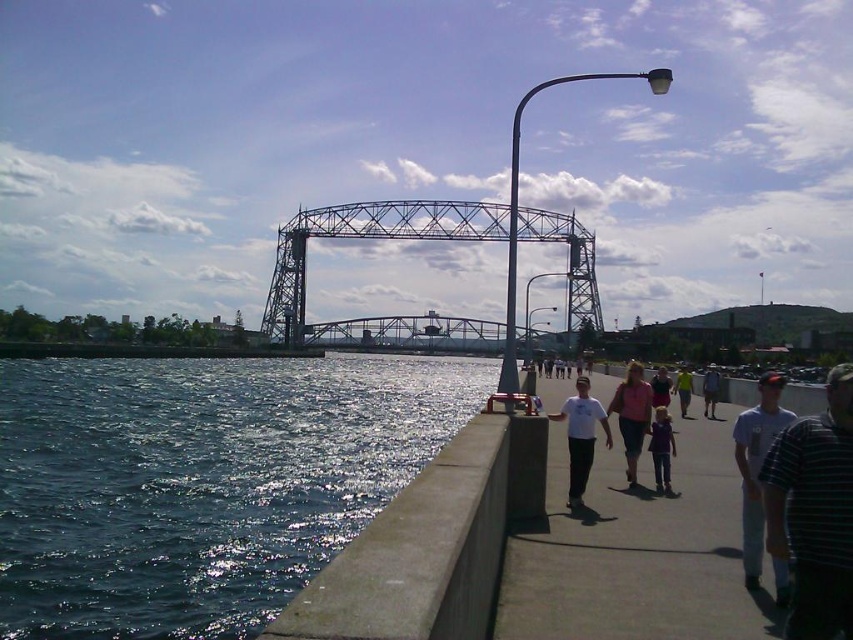
Does concrete sidewalk at center have a lesser height compared to pink fabric shirt at center?

Incorrect, concrete sidewalk at center's height does not fall short of pink fabric shirt at center's.

Who is lower down, concrete sidewalk at center or pink fabric shirt at center?

Positioned lower is concrete sidewalk at center.

You are a GUI agent. You are given a task and a screenshot of the screen. Output one action in this format:
    pyautogui.click(x=<x>, y=<y>)
    Task: Click on the concrete sidewalk at center
    This screenshot has width=853, height=640.
    Given the screenshot: What is the action you would take?
    pyautogui.click(x=637, y=550)

Who is more forward, (563,538) or (752,454)?

Point (563,538)

Does concrete sidewalk at center have a greater width compared to white cotton shirt at right?

Indeed, concrete sidewalk at center has a greater width compared to white cotton shirt at right.

Who is more forward, (621, 573) or (757, 481)?

Positioned in front is point (621, 573).

Locate an element on the screen. The image size is (853, 640). concrete sidewalk at center is located at coordinates (637, 550).

Which is more to the left, striped shirt at right or light blue shirt at center?

From the viewer's perspective, light blue shirt at center appears more on the left side.

Is point (837, 522) closer to viewer compared to point (688, 385)?

Yes, point (837, 522) is closer to viewer.

Locate an element on the screen. The height and width of the screenshot is (640, 853). striped shirt at right is located at coordinates (814, 513).